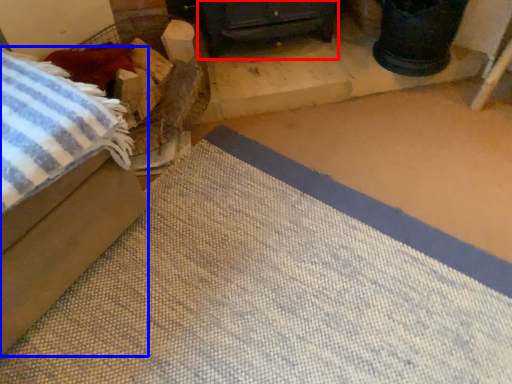
Question: Which of the following is the farthest to the observer, furniture (highlighted by a red box) or furniture (highlighted by a blue box)?

Choices:
 (A) furniture
 (B) furniture

Answer: (A)